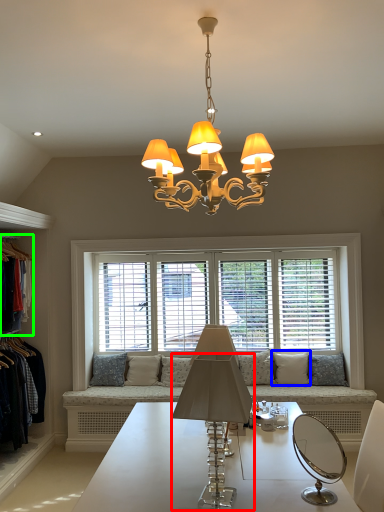
Question: Considering the real-world distances, which object is farthest from lamp (highlighted by a red box)? pillow (highlighted by a blue box) or clothing (highlighted by a green box)?

Choices:
 (A) pillow
 (B) clothing

Answer: (A)